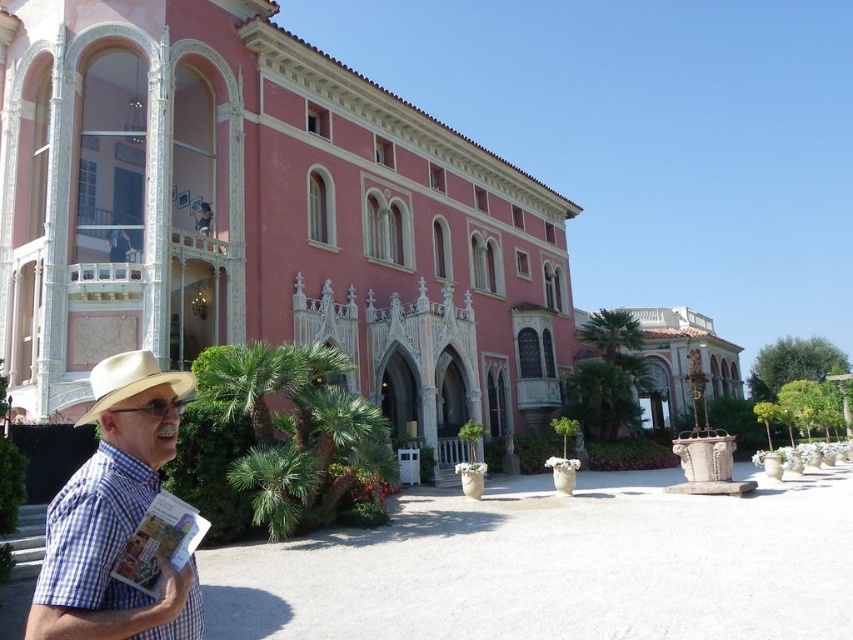
Can you confirm if matte pink building at center is positioned to the right of white felt cowboy hat at lower left?

Indeed, matte pink building at center is positioned on the right side of white felt cowboy hat at lower left.

Does point (642, 310) come farther from viewer compared to point (91, 388)?

Yes, it is behind point (91, 388).

Between point (674, 336) and point (99, 376), which one is positioned in front?

Point (99, 376) is in front.

At what (x,y) coordinates should I click in order to perform the action: click on matte pink building at center. Please return your answer as a coordinate pair (x, y). Looking at the image, I should click on (682, 362).

Can you confirm if blue checkered shirt at lower left is smaller than matte pink building at center?

Correct, blue checkered shirt at lower left occupies less space than matte pink building at center.

Is point (184, 582) farther from camera compared to point (717, 384)?

No, it is not.

In order to click on blue checkered shirt at lower left in this screenshot , I will do `click(115, 515)`.

Is pink stucco palace at center smaller than blue checkered shirt at lower left?

Incorrect, pink stucco palace at center is not smaller in size than blue checkered shirt at lower left.

Between pink stucco palace at center and blue checkered shirt at lower left, which one appears on the left side from the viewer's perspective?

blue checkered shirt at lower left is more to the left.

The height and width of the screenshot is (640, 853). What do you see at coordinates (260, 218) in the screenshot?
I see `pink stucco palace at center` at bounding box center [260, 218].

Identify the location of pink stucco palace at center. Image resolution: width=853 pixels, height=640 pixels. (260, 218).